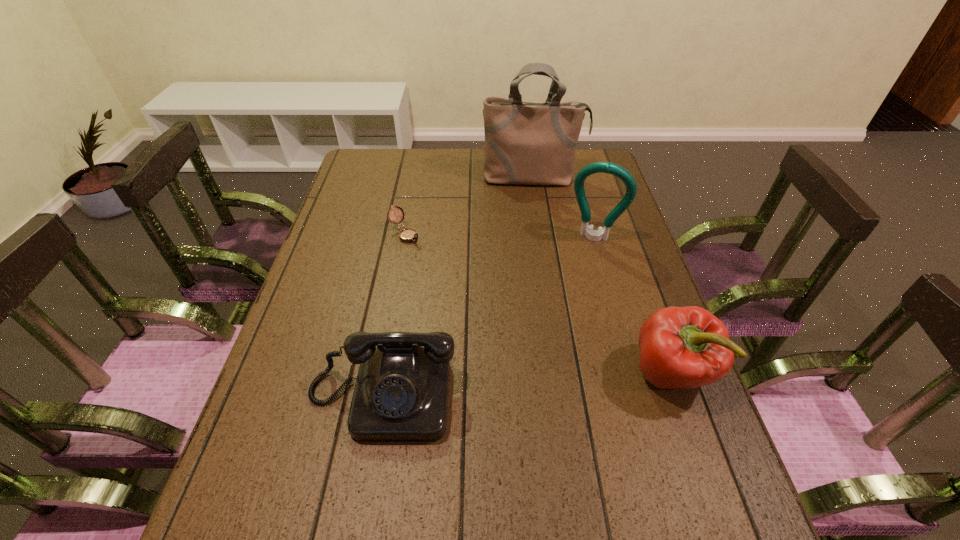
Locate an element on the screen. free spot between the second shortest object and the shoulder bag is located at coordinates (457, 287).

The image size is (960, 540). I want to click on object that is the third closest one to the shortest object, so click(598, 167).

Select which object appears as the closest to the compass. Please provide its 2D coordinates. Your answer should be formatted as a tuple, i.e. [(x, y)], where the tuple contains the x and y coordinates of a point satisfying the conditions above.

[(526, 143)]

I want to click on free space that satisfies the following two spatial constraints: 1. on the back side of the tallest object; 2. on the left side of the shortest object, so pos(416,178).

Locate an element on the screen. vacant area that satisfies the following two spatial constraints: 1. on the front side of the bell pepper; 2. on the right side of the bottle opener is located at coordinates (633, 373).